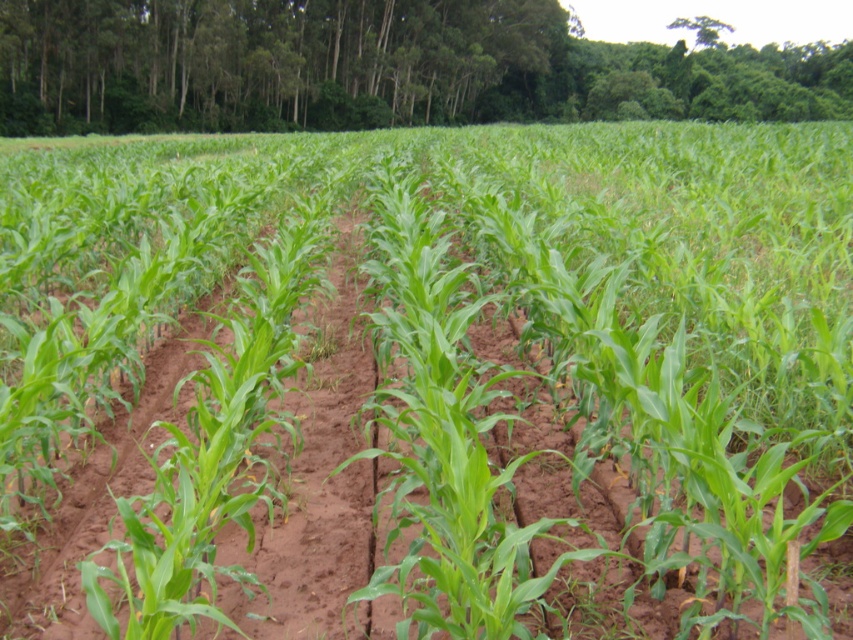
You are standing in the cornfield and want to reach the point at the top of the image. Which point should you walk towards, point at point at (97, 99) or point at (706, 26)?

You should walk towards point at (706, 26) because it is located at the top of the image, while point at (97, 99) is closer to the viewer and likely positioned lower down.

Consider the image. You are a farmer standing at the edge of the cornfield and notice the green leafy trees at upper center and the green leafy tree at upper center. Which one is farther away from you?

The green leafy trees at upper center is 67.31 meters from green leafy tree at upper center, so the green leafy trees at upper center is farther away from you.

You are a farmer planning to plant new corn rows between the green leafy trees at upper center and the green leafy tree at upper center. Which tree should you consider for spacing your new rows closer to, given their height differences?

The green leafy tree at upper center is shorter than the green leafy trees at upper center. Therefore, you should plant the new corn rows closer to the green leafy tree at upper center to avoid shading from the taller trees.